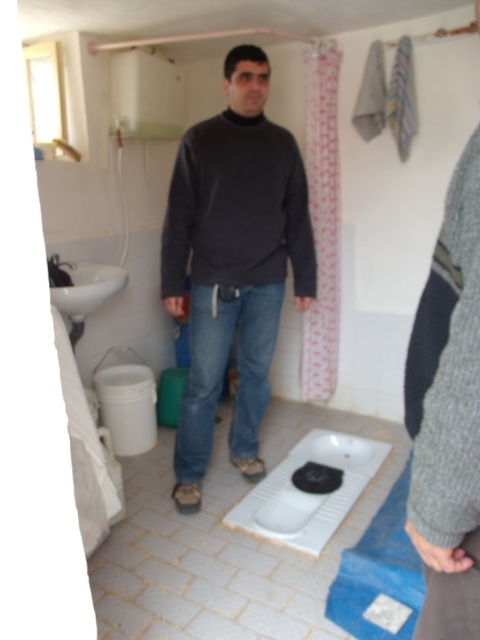
In the scene shown: You are a guest in this bathroom and need to use the facilities. You see a dark gray sweater at center and a white glossy urinal at center. Which object is closer to you?

The dark gray sweater at center is closer to you because the white glossy urinal at center is behind it.

You are a maintenance worker checking the bathroom facilities. You need to determine if the white glossy urinal at center can be placed on top of the blue fabric mat at lower center. Based on their heights, is this possible?

The white glossy urinal at center has a lesser height compared to blue fabric mat at lower center, so it can be placed on top since it is shorter than the mat.

Please provide the coordinates of the white glossy urinal at center in the bathroom scene described.

The white glossy urinal at center is located at coordinates point (309, 493).